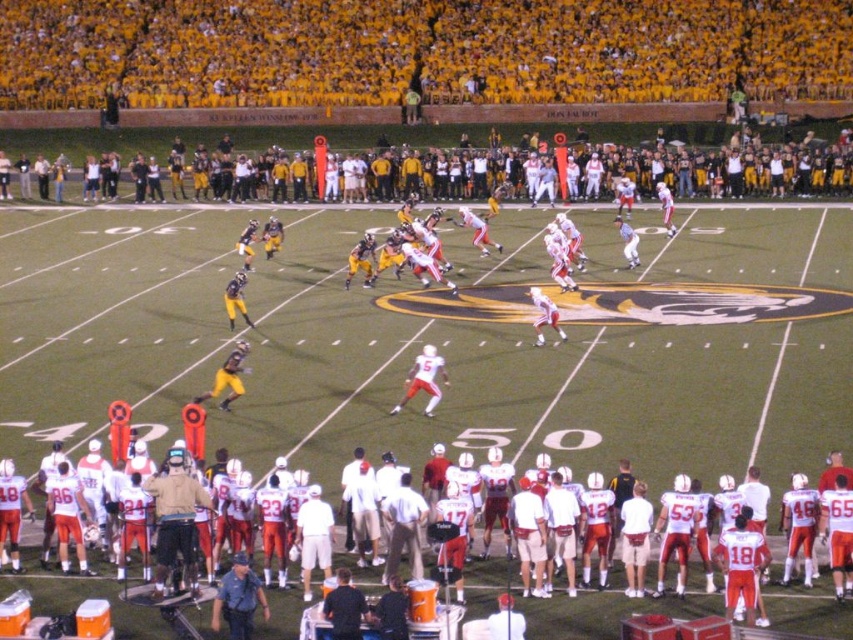
You are a spectator at the American football game. You notice two points marked on the field at coordinates point [596,38] and point [479,609]. Which point is closer to your position as a spectator?

Point [596,38] is closer to your position because it is further to the viewer than point [479,609], meaning it is nearer to where you are sitting.

You are a referee at the football game and need to determine the position of the players. Which player is positioned behind the other between the yellow jersey at upper center and the white matte uniform at center?

The white matte uniform at center is behind the yellow jersey at upper center.

You are a sports analyst watching the game. You notice two players, the yellow jersey at upper center and the white matte uniform at center. Which player appears taller in the image?

The yellow jersey at upper center appears taller than the white matte uniform at center in the image.